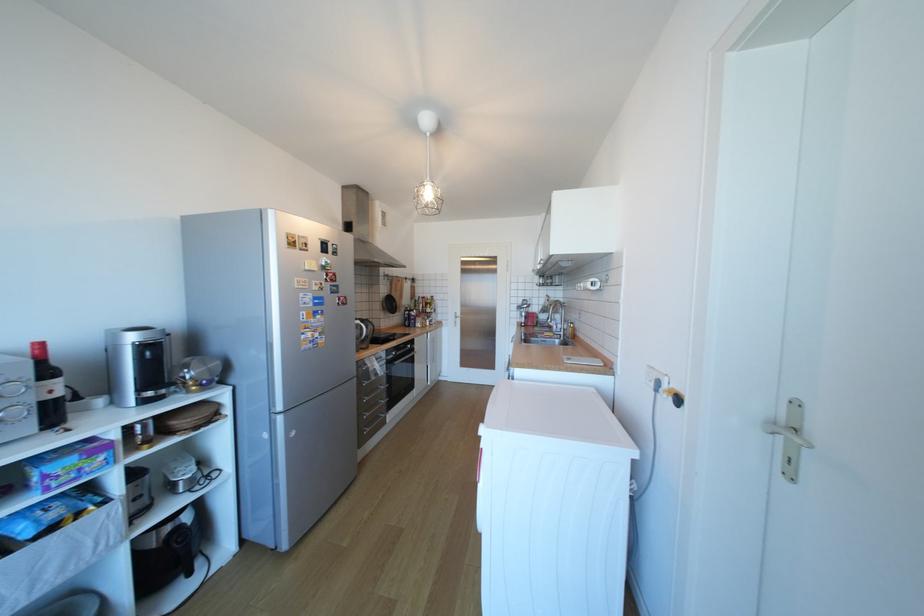
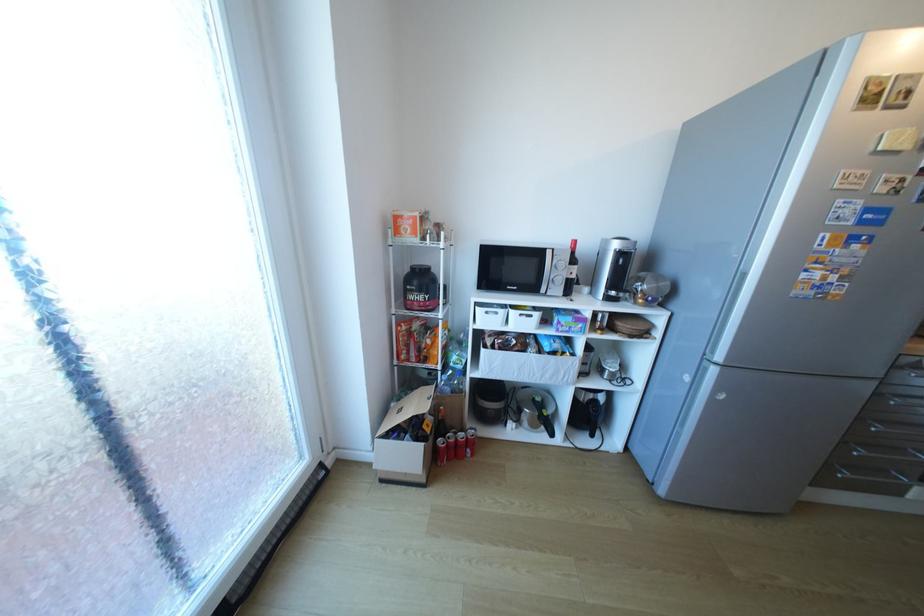
The point at (371, 440) is marked in the first image. Where is the corresponding point in the second image?

(834, 480)